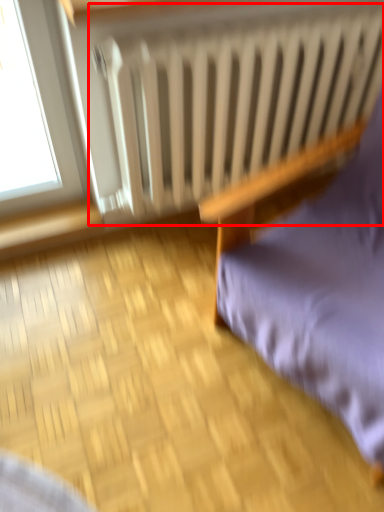
Question: Where is radiator (annotated by the red box) located in relation to furniture in the image?

Choices:
 (A) left
 (B) right

Answer: (A)